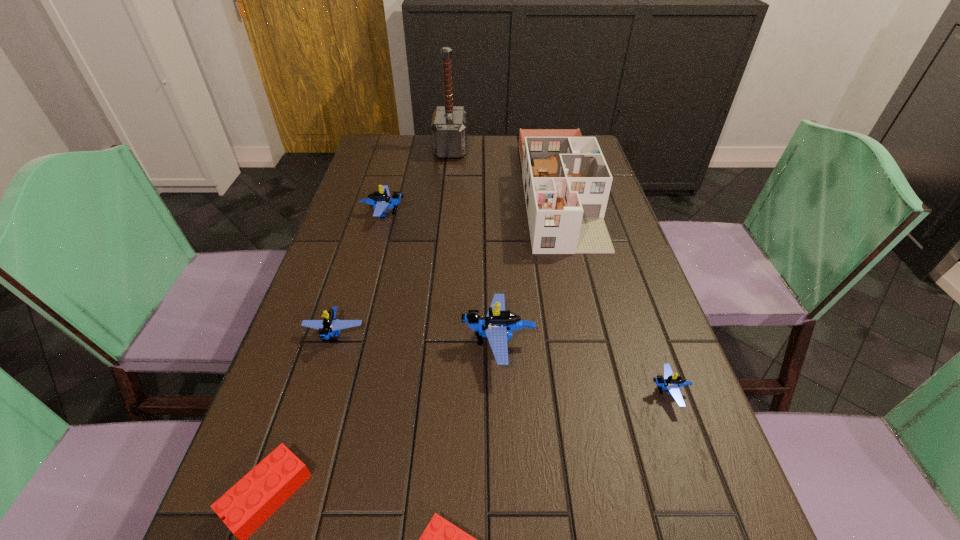
You are a GUI agent. You are given a task and a screenshot of the screen. Output one action in this format:
    pyautogui.click(x=<x>, y=<y>)
    Task: Click on the free space located on the front-facing side of the third shortest object
    The height and width of the screenshot is (540, 960).
    Given the screenshot: What is the action you would take?
    pyautogui.click(x=460, y=392)

Find the location of `hammer present at the far edge`. hammer present at the far edge is located at coordinates (449, 123).

Identify the location of dollhouse present at the far edge. (x=566, y=180).

Identify the location of dollhouse that is at the right edge. The image size is (960, 540). (566, 180).

In order to click on Lego at the right edge in this screenshot , I will do `click(670, 382)`.

At what (x,y) coordinates should I click in order to perform the action: click on object situated at the far right corner. Please return your answer as a coordinate pair (x, y). The width and height of the screenshot is (960, 540). Looking at the image, I should click on (566, 180).

Find the location of a particular element. The image size is (960, 540). blank space at the far edge is located at coordinates (490, 157).

In order to click on free space at the left edge of the desktop in this screenshot , I will do `click(348, 235)`.

The width and height of the screenshot is (960, 540). In the image, there is a desktop. Identify the location of vacant space at the right edge. (590, 256).

Find the location of a particular element. This screenshot has width=960, height=540. empty space that is in between the white dollhouse and the tallest object is located at coordinates (505, 170).